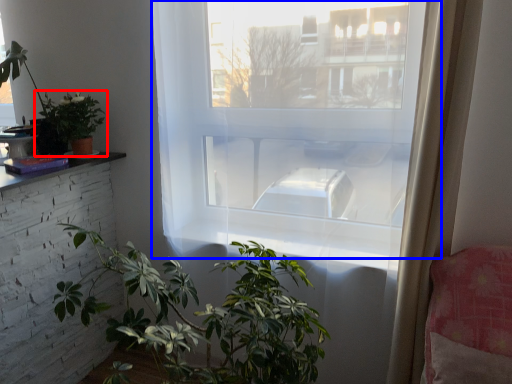
Question: Which of the following is the closest to the observer, houseplant (highlighted by a red box) or window (highlighted by a blue box)?

Choices:
 (A) houseplant
 (B) window

Answer: (B)